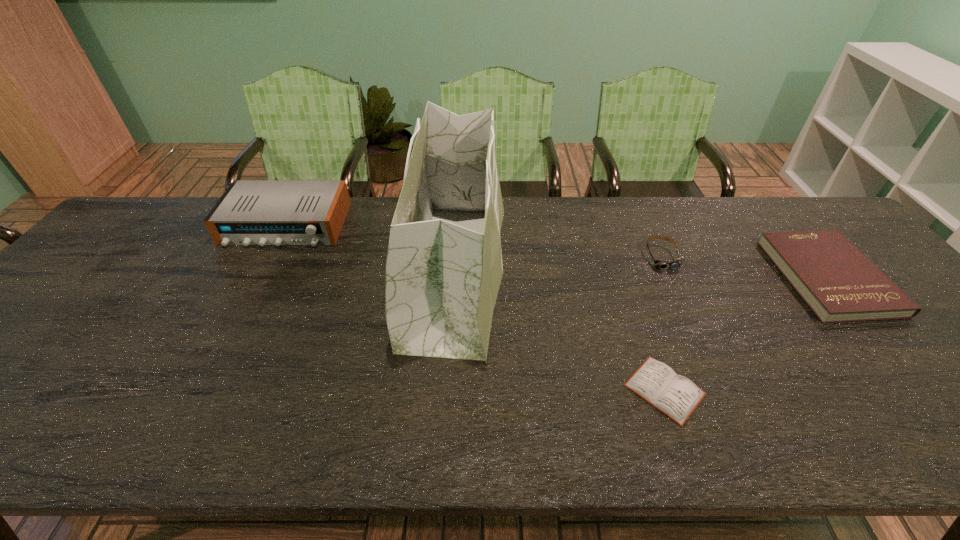
Where is `free space located 0.050m on the back of the hardback book`? free space located 0.050m on the back of the hardback book is located at coordinates (789, 229).

At what (x,y) coordinates should I click in order to perform the action: click on vacant space located 0.390m on the back of the diary. Please return your answer as a coordinate pair (x, y). The height and width of the screenshot is (540, 960). Looking at the image, I should click on (615, 247).

This screenshot has height=540, width=960. I want to click on grocery bag that is at the far edge, so click(x=442, y=280).

Where is `radio receiver present at the far edge`? The image size is (960, 540). radio receiver present at the far edge is located at coordinates (250, 212).

This screenshot has height=540, width=960. In order to click on goggles that is at the far edge in this screenshot , I will do `click(677, 263)`.

The width and height of the screenshot is (960, 540). Identify the location of hardback book that is positioned at the far edge. (839, 283).

I want to click on object that is at the near edge, so click(676, 396).

Where is `object present at the right edge`? Image resolution: width=960 pixels, height=540 pixels. object present at the right edge is located at coordinates (839, 283).

The height and width of the screenshot is (540, 960). Identify the location of object at the far right corner. (839, 283).

Where is `vacant position at the far edge of the desktop`? Image resolution: width=960 pixels, height=540 pixels. vacant position at the far edge of the desktop is located at coordinates (602, 203).